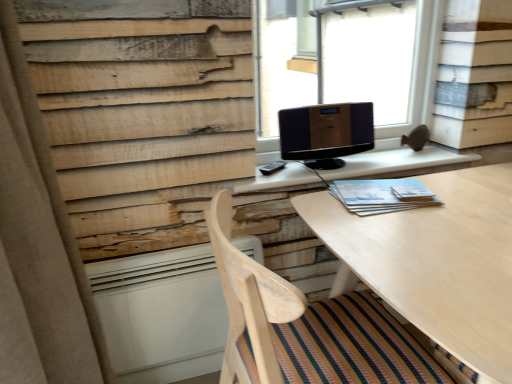
Locate an element on the screen. The image size is (512, 384). vacant space underneath shiny black monitor at center (from a real-world perspective) is located at coordinates (308, 167).